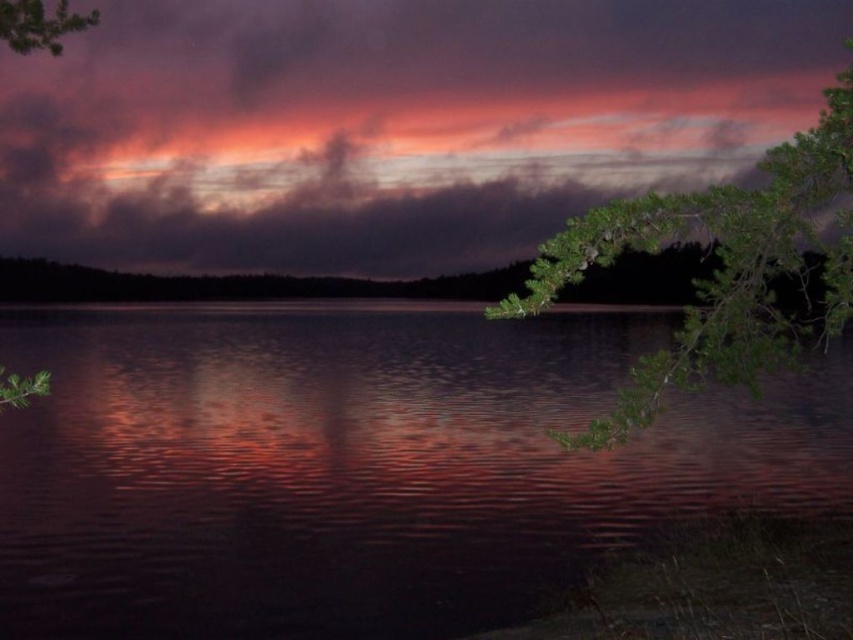
Is point (525, 556) positioned behind point (614, 221)?

That is True.

Locate an element on the screen. glossy water at center is located at coordinates (360, 465).

Which is in front, point (71, 540) or point (811, 140)?

Positioned in front is point (811, 140).

Find the location of a particular element. Image resolution: width=853 pixels, height=640 pixels. glossy water at center is located at coordinates pos(360,465).

Between cloudy sky at upper center and green leafy branch at right, which one has less height?

green leafy branch at right

Who is lower down, cloudy sky at upper center or green leafy branch at right?

Positioned lower is green leafy branch at right.

Which is in front, point (299, 52) or point (616, 412)?

Point (616, 412)

Where is `cloudy sky at upper center`? This screenshot has height=640, width=853. cloudy sky at upper center is located at coordinates (386, 124).

Is cloudy sky at upper center above green leafy branch at upper left?

Actually, cloudy sky at upper center is below green leafy branch at upper left.

Does point (492, 262) lie in front of point (3, 13)?

No, it is behind (3, 13).

Is point (531, 3) farther from camera compared to point (33, 40)?

Yes.

Where is `cloudy sky at upper center`? cloudy sky at upper center is located at coordinates (386, 124).